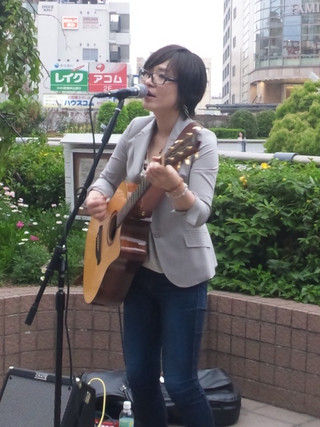
Locate an element on the screen. The height and width of the screenshot is (427, 320). speaker is located at coordinates (30, 404).